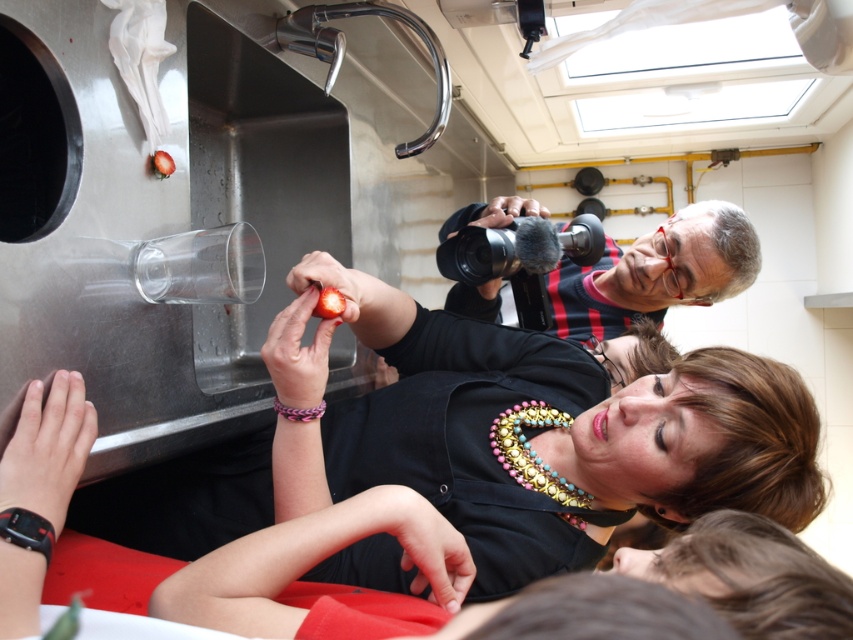
Is matte black camera at upper right below black rubber bracelet at lower left?

No, matte black camera at upper right is not below black rubber bracelet at lower left.

Is matte black camera at upper right shorter than black rubber bracelet at lower left?

No, matte black camera at upper right is not shorter than black rubber bracelet at lower left.

Is point (660, 307) positioned before point (12, 508)?

No, (660, 307) is behind (12, 508).

At what (x,y) coordinates should I click in order to perform the action: click on matte black camera at upper right. Please return your answer as a coordinate pair (x, y). Looking at the image, I should click on (656, 273).

Is matte black camera at upper right shorter than pink woven bracelet at center?

No.

This screenshot has width=853, height=640. I want to click on matte black camera at upper right, so click(x=656, y=273).

Is matte black shirt at center further to the viewer compared to black rubber bracelet at lower left?

Yes.

Is matte black shirt at center to the right of black rubber bracelet at lower left from the viewer's perspective?

Yes, matte black shirt at center is to the right of black rubber bracelet at lower left.

Is point (648, 506) closer to camera compared to point (10, 529)?

No, it is behind (10, 529).

The height and width of the screenshot is (640, 853). I want to click on matte black shirt at center, so click(x=572, y=420).